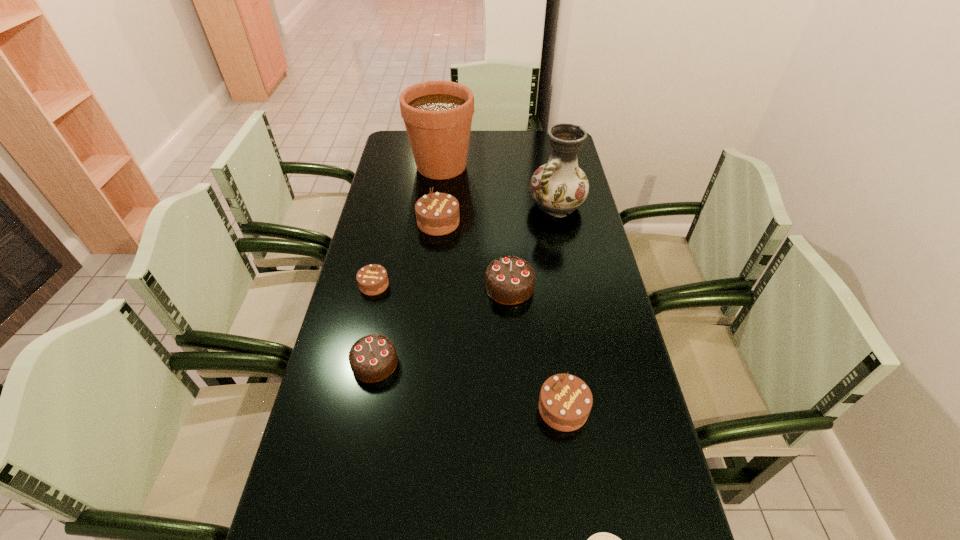
Identify the location of the smallest brown chocolate cake. The height and width of the screenshot is (540, 960). (372, 279).

Identify the location of the second nearest brown chocolate cake. (372, 279).

Find the location of a particular element. This screenshot has width=960, height=540. vacant space positioned on the right of the flowerpot is located at coordinates (524, 166).

Where is `vacant area situated on the left of the red vase`? vacant area situated on the left of the red vase is located at coordinates (471, 206).

Where is `vacant point located on the right of the second brown chocolate cake from left to right`? This screenshot has height=540, width=960. vacant point located on the right of the second brown chocolate cake from left to right is located at coordinates (548, 222).

Find the location of a particular element. The image size is (960, 540). vacant space located 0.320m on the front of the farther chocolate chocolate cake is located at coordinates (517, 408).

In order to click on vacant space located on the left of the nearest brown chocolate cake in this screenshot , I will do `click(505, 409)`.

The height and width of the screenshot is (540, 960). What are the coordinates of `free region located 0.350m on the back of the fourth farthest chocolate cake` in the screenshot? It's located at (396, 255).

You are a GUI agent. You are given a task and a screenshot of the screen. Output one action in this format:
    pyautogui.click(x=<x>, y=<y>)
    Task: Click on the free space located 0.370m on the back of the leftmost brown chocolate cake
    The width and height of the screenshot is (960, 540).
    Given the screenshot: What is the action you would take?
    pyautogui.click(x=393, y=202)

Find the location of a particular element. object located in the far edge section of the desktop is located at coordinates (438, 115).